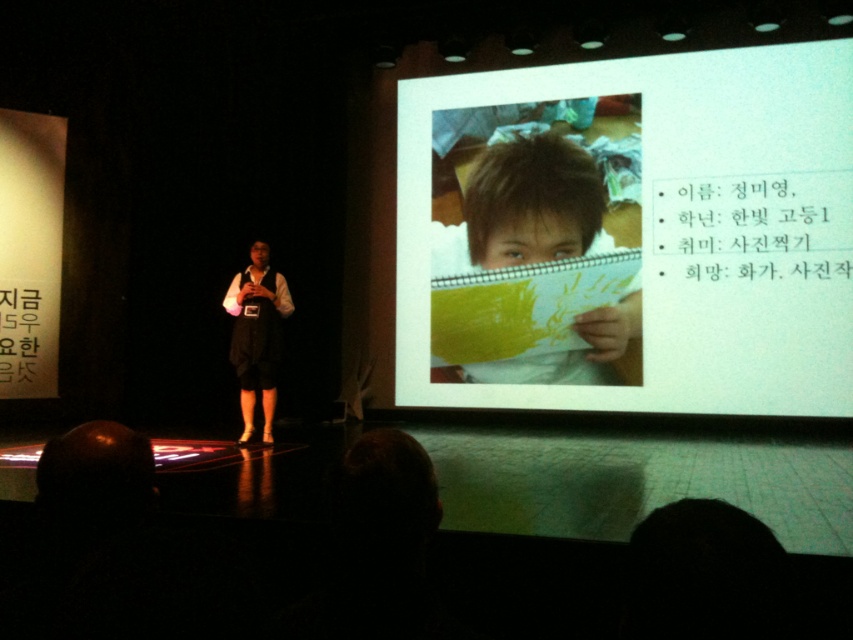
Question: Is matte paper at upper center to the right of matte yellow paper at center from the viewer's perspective?

Choices:
 (A) yes
 (B) no

Answer: (A)

Question: Which point is closer to the camera taking this photo?

Choices:
 (A) (244, 289)
 (B) (624, 289)

Answer: (A)

Question: Which is nearer to the white fabric shirt at center?

Choices:
 (A) matte paper at upper center
 (B) matte yellow paper at center

Answer: (B)

Question: From the image, what is the correct spatial relationship of matte yellow paper at center in relation to white fabric shirt at center?

Choices:
 (A) below
 (B) above

Answer: (B)

Question: Considering the relative positions of matte paper at upper center and matte yellow paper at center in the image provided, where is matte paper at upper center located with respect to matte yellow paper at center?

Choices:
 (A) right
 (B) left

Answer: (A)

Question: Which point is closer to the camera taking this photo?

Choices:
 (A) (270, 400)
 (B) (570, 333)
 (C) (601, 308)

Answer: (A)